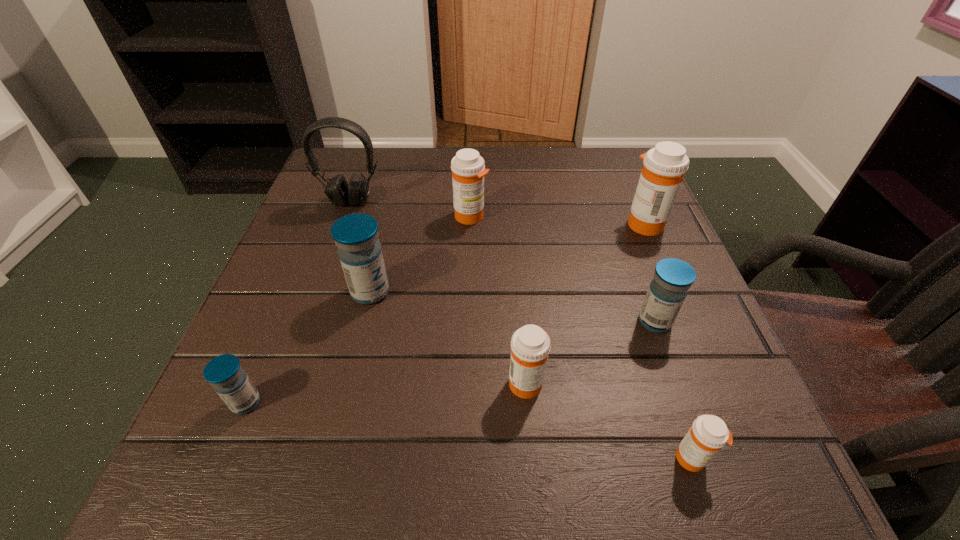
Image resolution: width=960 pixels, height=540 pixels. Find the location of `vacant space that satisfies the following two spatial constraints: 1. on the front-facing side of the headset; 2. on the left side of the leftmost orange medicine`. vacant space that satisfies the following two spatial constraints: 1. on the front-facing side of the headset; 2. on the left side of the leftmost orange medicine is located at coordinates (346, 216).

Where is `vacant space that satisfies the following two spatial constraints: 1. on the front-facing side of the headset; 2. on the left side of the second smallest orange medicine`? The image size is (960, 540). vacant space that satisfies the following two spatial constraints: 1. on the front-facing side of the headset; 2. on the left side of the second smallest orange medicine is located at coordinates (288, 382).

Where is `vacant space that satisfies the following two spatial constraints: 1. on the front-facing side of the fifth object from left to right; 2. on the right side of the headset`? vacant space that satisfies the following two spatial constraints: 1. on the front-facing side of the fifth object from left to right; 2. on the right side of the headset is located at coordinates (288, 382).